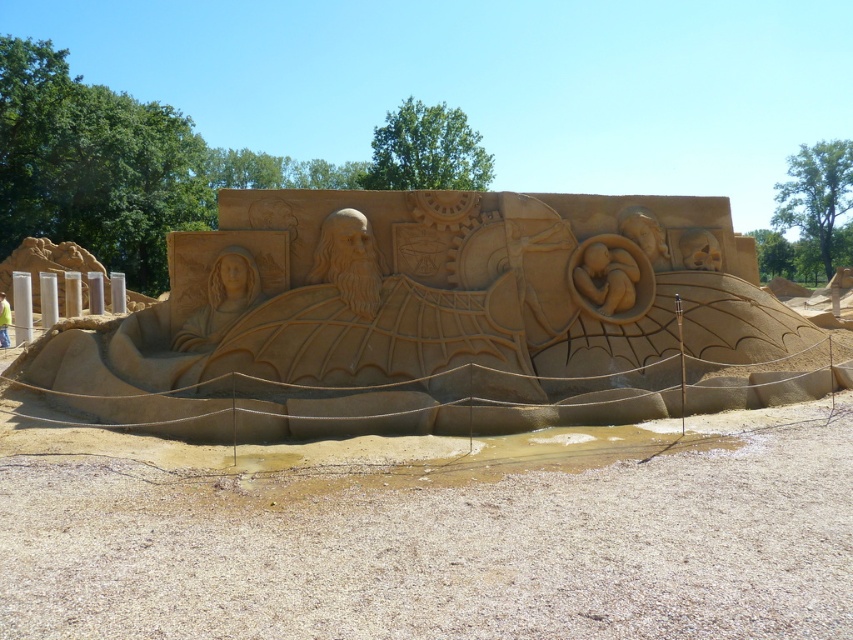
Is point (442, 374) farther from viewer compared to point (339, 269)?

No, (442, 374) is closer to viewer.

This screenshot has height=640, width=853. Describe the element at coordinates (442, 323) in the screenshot. I see `sandy sculpture at center` at that location.

I want to click on sandy sculpture at center, so click(x=442, y=323).

Is sandy sculpture at center taller than matte sand sculpture at center?

Correct, sandy sculpture at center is much taller as matte sand sculpture at center.

Find the location of `sandy sculpture at center`. sandy sculpture at center is located at coordinates (442, 323).

Is point (62, 358) farther from camera compared to point (228, 294)?

No, it is in front of (228, 294).

Image resolution: width=853 pixels, height=640 pixels. I want to click on sandy sculpture at center, so click(x=442, y=323).

Find the location of a particular element. This screenshot has width=853, height=640. smooth sand sculpture at center is located at coordinates (349, 260).

Between point (328, 257) and point (222, 280), which one is positioned in front?

Point (222, 280) is more forward.

Between point (343, 268) and point (202, 326), which one is positioned in front?

Point (202, 326) is more forward.

Where is `smooth sand sculpture at center`? smooth sand sculpture at center is located at coordinates (349, 260).